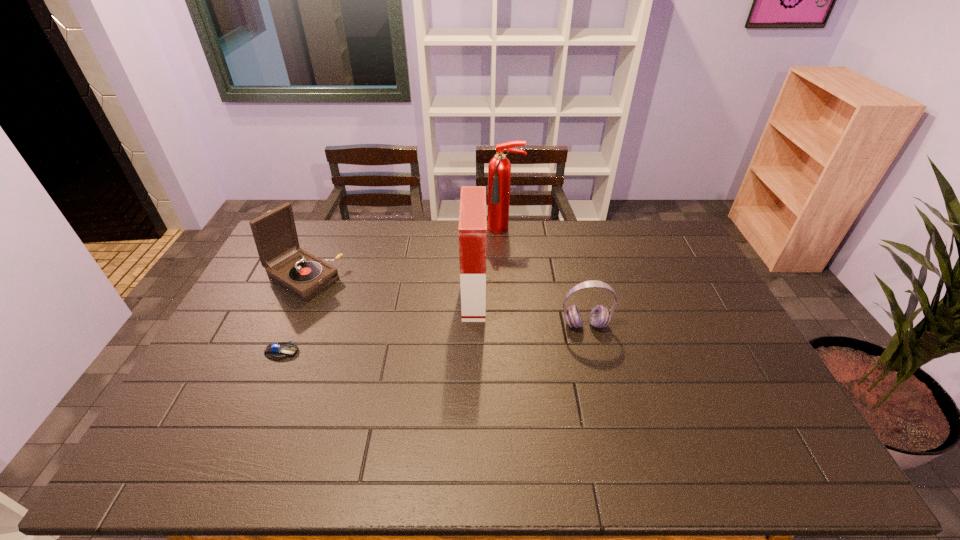
I want to click on the farthest object, so [x=499, y=168].

You are a GUI agent. You are given a task and a screenshot of the screen. Output one action in this format:
    pyautogui.click(x=<x>, y=<y>)
    Task: Click on the second object from right to left
    This screenshot has width=960, height=540.
    Given the screenshot: What is the action you would take?
    pyautogui.click(x=499, y=168)

The width and height of the screenshot is (960, 540). I want to click on the third object from right to left, so click(x=472, y=230).

This screenshot has height=540, width=960. What are the coordinates of `the third tallest object` in the screenshot? It's located at (304, 275).

Locate an element on the screen. This screenshot has height=540, width=960. the rightmost object is located at coordinates (599, 317).

Identify the location of headset. The image size is (960, 540). (599, 317).

This screenshot has height=540, width=960. Find the location of `the nearest object`. the nearest object is located at coordinates (277, 351).

Locate an element on the screen. The image size is (960, 540). computer mouse is located at coordinates (277, 351).

At what (x,y) coordinates should I click in order to perform the action: click on blank space located 0.320m at the nozzle of the farthest object. Please return your answer as a coordinate pair (x, y). The image size is (960, 540). Looking at the image, I should click on (510, 295).

Find the location of a particular element. This screenshot has width=960, height=540. free space located 0.120m on the front-facing side of the third object from right to left is located at coordinates (521, 297).